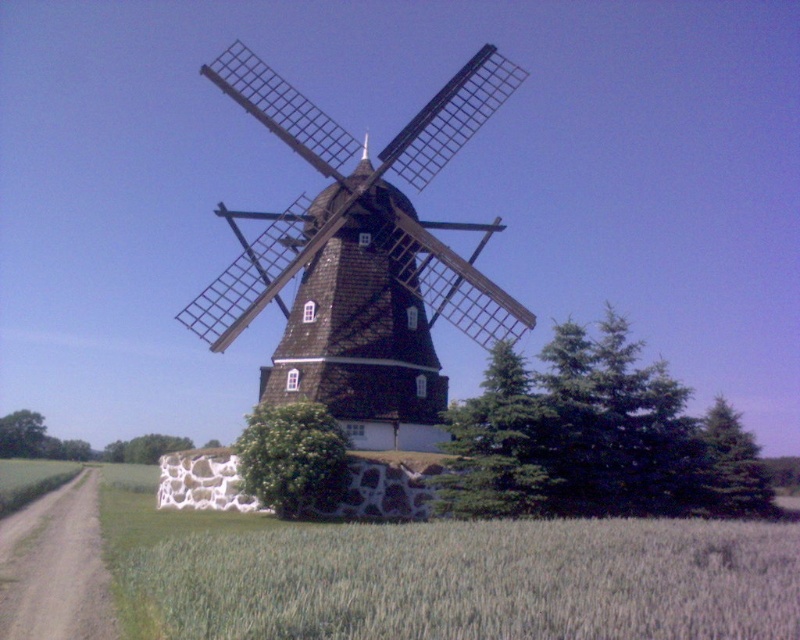
Question: Does green evergreen tree at center have a larger size compared to green coniferous tree at right?

Choices:
 (A) no
 (B) yes

Answer: (A)

Question: Among these objects, which one is farthest from the camera?

Choices:
 (A) green coniferous tree at right
 (B) green grassy wheat field at lower left
 (C) green coniferous tree at center
 (D) green leafy tree at lower left

Answer: (D)

Question: Which of these objects is positioned farthest from the dark brown wood windmill at center?

Choices:
 (A) green coniferous tree at center
 (B) green evergreen tree at center
 (C) green grassy wheat field at lower left

Answer: (C)

Question: Is green evergreen tree at center thinner than green leafy tree at lower left?

Choices:
 (A) yes
 (B) no

Answer: (A)

Question: Which point is closer to the camera taking this photo?

Choices:
 (A) (444, 488)
 (B) (513, 90)
 (C) (594, 365)
 (D) (756, 588)

Answer: (D)

Question: Can you confirm if green evergreen tree at center is positioned above green leafy bush at center?

Choices:
 (A) yes
 (B) no

Answer: (A)